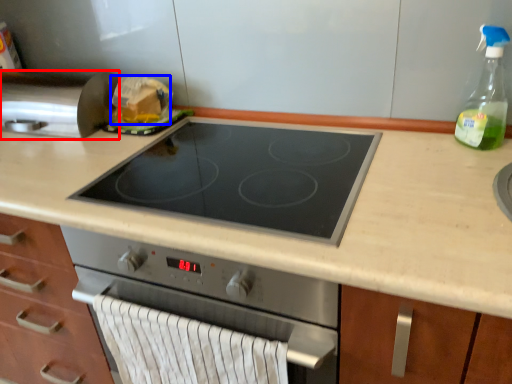
Question: Which object appears closest to the camera in this image, kitchen appliance (highlighted by a red box) or food (highlighted by a blue box)?

Choices:
 (A) kitchen appliance
 (B) food

Answer: (A)